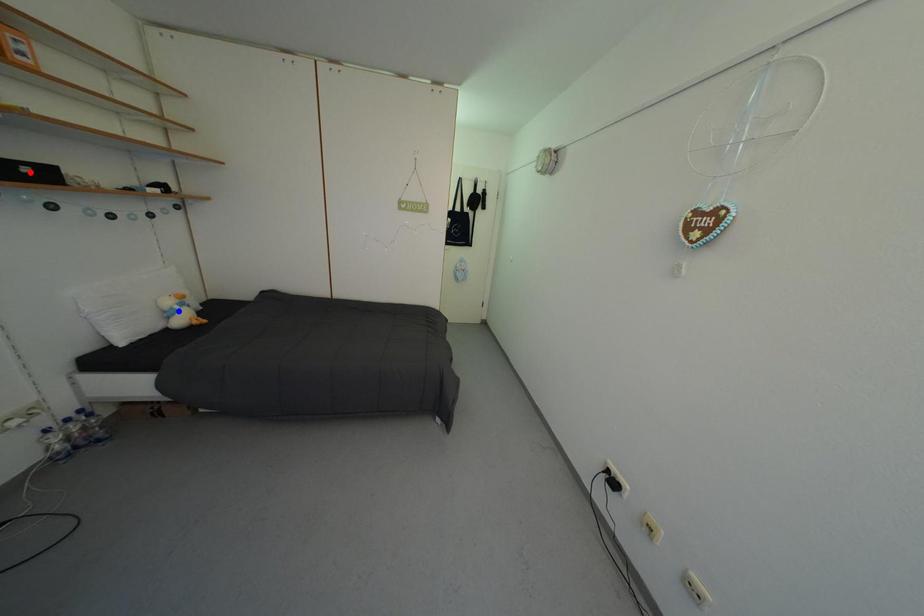
Question: Which of the two points in the image is closer to the camera?

Choices:
 (A) Blue point is closer.
 (B) Red point is closer.

Answer: (B)